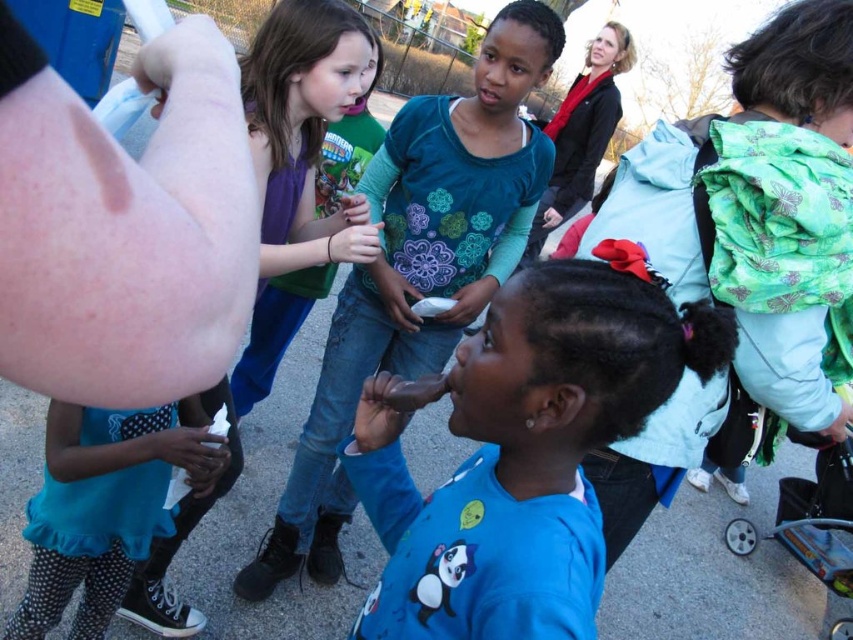
Between blue matte shirt at center and matte purple tank top at center, which one is positioned higher?

matte purple tank top at center

Is blue matte shirt at center to the right of matte purple tank top at center from the viewer's perspective?

Indeed, blue matte shirt at center is positioned on the right side of matte purple tank top at center.

Between point (376, 412) and point (285, 64), which one is positioned behind?

Positioned behind is point (285, 64).

At what (x,y) coordinates should I click in order to perform the action: click on blue matte shirt at center. Please return your answer as a coordinate pair (x, y). Looking at the image, I should click on (521, 454).

Is blue matte shirt at center thinner than blue cotton shirt at center?

Correct, blue matte shirt at center's width is less than blue cotton shirt at center's.

Measure the distance between point (x=418, y=572) and camera.

Point (x=418, y=572) and camera are 1.12 meters apart.

Which is in front, point (418, 628) or point (496, 13)?

Point (418, 628)

Where is `blue matte shirt at center`? Image resolution: width=853 pixels, height=640 pixels. blue matte shirt at center is located at coordinates (521, 454).

Looking at this image, is blue cotton shirt at center behind matte purple tank top at center?

Yes, it is.

Which of these two, blue cotton shirt at center or matte purple tank top at center, stands shorter?

matte purple tank top at center is shorter.

Does point (422, 125) come farther from viewer compared to point (373, 68)?

That is False.

The width and height of the screenshot is (853, 640). What are the coordinates of `blue cotton shirt at center` in the screenshot? It's located at (418, 268).